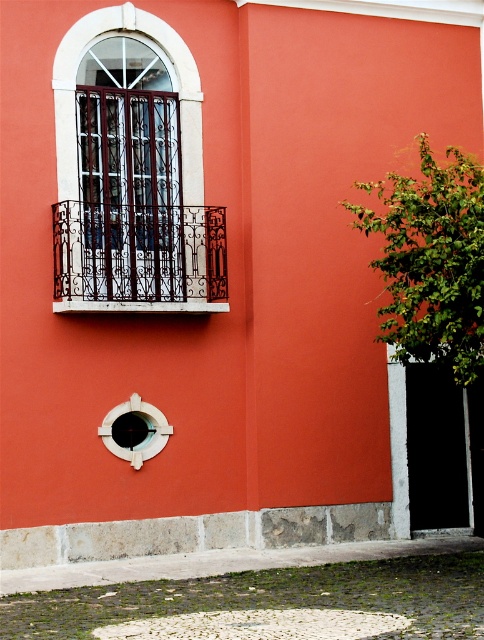
Is white wrought iron balcony at upper left below white plastic hole at lower center?

Incorrect, white wrought iron balcony at upper left is not positioned below white plastic hole at lower center.

Does white wrought iron balcony at upper left have a larger size compared to white plastic hole at lower center?

Yes, white wrought iron balcony at upper left is bigger than white plastic hole at lower center.

This screenshot has height=640, width=484. I want to click on white wrought iron balcony at upper left, so (138, 257).

The image size is (484, 640). Find the location of `white wrought iron balcony at upper left`. white wrought iron balcony at upper left is located at coordinates (138, 257).

Is point (95, 221) farther from viewer compared to point (121, 442)?

No, it is in front of (121, 442).

Is white wrought iron balcony at upper left smaller than smooth white circle at center?

No.

This screenshot has height=640, width=484. In order to click on white wrought iron balcony at upper left in this screenshot , I will do `click(138, 257)`.

I want to click on white wrought iron balcony at upper left, so click(138, 257).

Is matte black metal bars at upper left in front of white wrought iron balcony at upper left?

No, it is behind white wrought iron balcony at upper left.

Can you confirm if matte black metal bars at upper left is bigger than white wrought iron balcony at upper left?

Yes.

Does point (86, 129) come in front of point (136, 296)?

No, (86, 129) is further to viewer.

Locate an element on the screen. The image size is (484, 640). matte black metal bars at upper left is located at coordinates (132, 177).